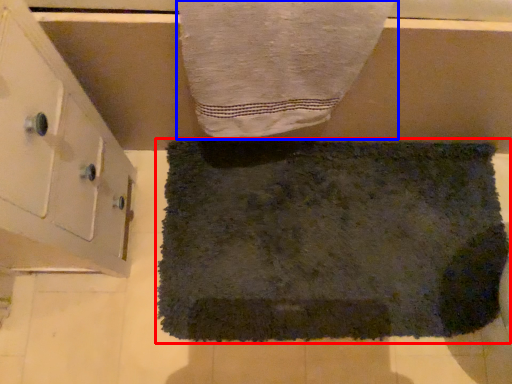
Question: Which object appears closest to the camera in this image, towel (highlighted by a red box) or towel (highlighted by a blue box)?

Choices:
 (A) towel
 (B) towel

Answer: (B)